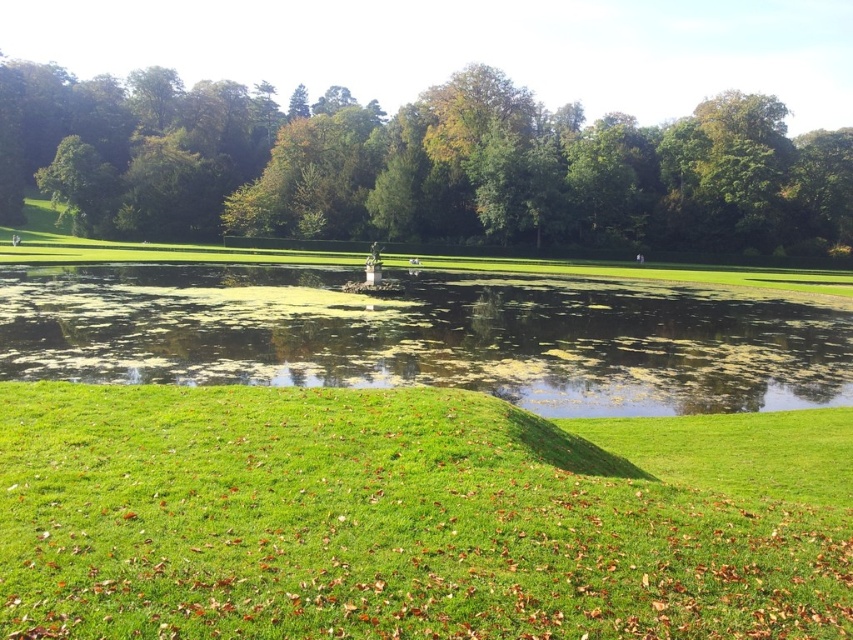
Is green leafy tree at center positioned before green algae-covered water at center?

No.

Between green leafy tree at center and green algae-covered water at center, which one has less height?

green algae-covered water at center

The width and height of the screenshot is (853, 640). Describe the element at coordinates (416, 166) in the screenshot. I see `green leafy tree at center` at that location.

You are a GUI agent. You are given a task and a screenshot of the screen. Output one action in this format:
    pyautogui.click(x=<x>, y=<y>)
    Task: Click on the green leafy tree at center
    The width and height of the screenshot is (853, 640).
    Given the screenshot: What is the action you would take?
    pyautogui.click(x=416, y=166)

Who is positioned more to the left, green grass at lower center or green algae-covered water at center?

green algae-covered water at center

Who is positioned more to the right, green grass at lower center or green algae-covered water at center?

Positioned to the right is green grass at lower center.

Between point (477, 500) and point (465, 321), which one is positioned behind?

Point (465, 321)

Find the location of a particular element. The image size is (853, 640). green grass at lower center is located at coordinates (412, 516).

Is point (679, 536) closer to viewer compared to point (187, 109)?

Yes, it is in front of point (187, 109).

Between point (228, 448) and point (490, 208), which one is positioned in front?

Point (228, 448)

Where is `green grass at lower center`? The width and height of the screenshot is (853, 640). green grass at lower center is located at coordinates (412, 516).